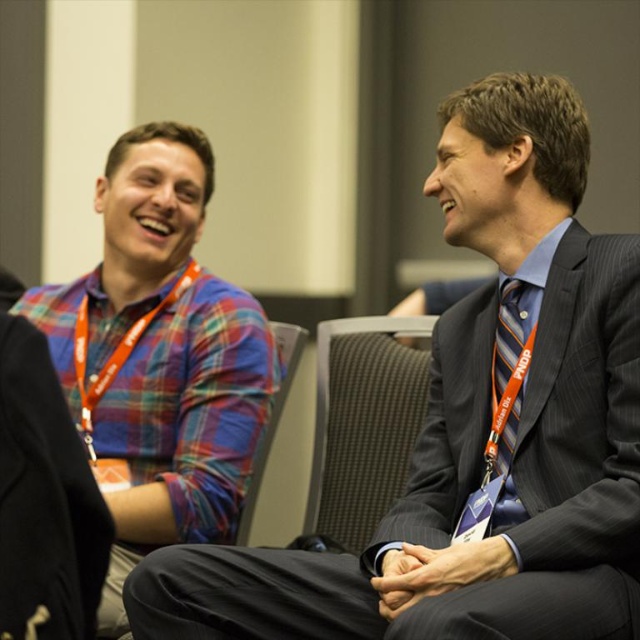
Between point (145, 234) and point (285, 346), which one is positioned behind?

The point (285, 346) is more distant.

What are the coordinates of `plaid fabric shirt at left` in the screenshot? It's located at (157, 356).

Who is more forward, (x=120, y=531) or (x=294, y=342)?

Point (x=120, y=531)

Locate an element on the screen. This screenshot has width=640, height=640. plaid fabric shirt at left is located at coordinates (157, 356).

Does plaid fabric shirt at left have a greater height compared to dark gray fabric chair at center?

Yes, plaid fabric shirt at left is taller than dark gray fabric chair at center.

Between plaid fabric shirt at left and dark gray fabric chair at center, which one appears on the right side from the viewer's perspective?

dark gray fabric chair at center is more to the right.

Which is in front, point (180, 189) or point (387, 400)?

Positioned in front is point (180, 189).

Locate an element on the screen. plaid fabric shirt at left is located at coordinates (157, 356).

Can you confirm if plaid fabric shirt at upper left is shorter than dark gray fabric chair at center?

In fact, plaid fabric shirt at upper left may be taller than dark gray fabric chair at center.

You are a GUI agent. You are given a task and a screenshot of the screen. Output one action in this format:
    pyautogui.click(x=<x>, y=<y>)
    Task: Click on the plaid fabric shirt at upper left
    
    Given the screenshot: What is the action you would take?
    pyautogui.click(x=476, y=428)